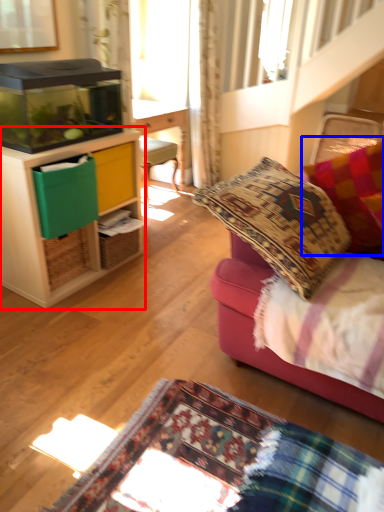
Question: Among these objects, which one is farthest to the camera, cabinetry (highlighted by a red box) or pillow (highlighted by a blue box)?

Choices:
 (A) cabinetry
 (B) pillow

Answer: (A)